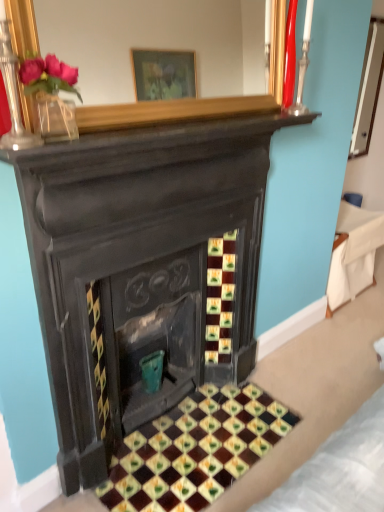
In order to face glazed ceramic tiles at center, should I rotate leftwards or rightwards?

You should rotate right by 1.078 degrees.

I want to click on glazed ceramic tiles at center, so click(194, 450).

From the image's perspective, which object appears higher, white fabric at right or teal ceramic vase at center?

white fabric at right, from the image's perspective.

Considering the relative sizes of white fabric at right and teal ceramic vase at center in the image provided, is white fabric at right thinner than teal ceramic vase at center?

In fact, white fabric at right might be wider than teal ceramic vase at center.

Based on the photo, from a real-world perspective, who is located higher, white fabric at right or teal ceramic vase at center?

white fabric at right.

The height and width of the screenshot is (512, 384). In order to click on teal that appears behind the glazed ceramic tiles at center in this screenshot , I will do `click(152, 371)`.

From a real-world perspective, is glazed ceramic tiles at center beneath teal ceramic vase at center?

Yes, from a real-world perspective, glazed ceramic tiles at center is below teal ceramic vase at center.

Considering the relative positions of glazed ceramic tiles at center and teal ceramic vase at center in the image provided, is glazed ceramic tiles at center to the right of teal ceramic vase at center from the viewer's perspective?

Yes, glazed ceramic tiles at center is to the right of teal ceramic vase at center.

How different are the orientations of teal ceramic vase at center and glazed ceramic tiles at center in degrees?

The angular difference between teal ceramic vase at center and glazed ceramic tiles at center is 0.00473 degrees.

Is teal ceramic vase at center positioned in front of glazed ceramic tiles at center?

No, teal ceramic vase at center is further to the viewer.

From a real-world perspective, relative to glazed ceramic tiles at center, is teal ceramic vase at center vertically above or below?

In terms of real-world spatial position, teal ceramic vase at center is above glazed ceramic tiles at center.

Is teal ceramic vase at center bigger or smaller than glazed ceramic tiles at center?

In the image, teal ceramic vase at center appears to be smaller than glazed ceramic tiles at center.

Is glazed ceramic tiles at center surrounded by white fabric at right?

Definitely not — glazed ceramic tiles at center is not inside white fabric at right.

Is white fabric at right not near glazed ceramic tiles at center?

Yes, white fabric at right is far from glazed ceramic tiles at center.

Where is `furniture above the glazed ceramic tiles at center (from a real-world perspective)`? furniture above the glazed ceramic tiles at center (from a real-world perspective) is located at coordinates (353, 253).

Is glazed ceramic tiles at center situated inside white fabric at right or outside?

glazed ceramic tiles at center is outside white fabric at right.

Looking at this image, does glazed ceramic tiles at center come behind white fabric at right?

No, glazed ceramic tiles at center is closer to the camera.

Which of these two, glazed ceramic tiles at center or white fabric at right, stands shorter?

With less height is glazed ceramic tiles at center.

Who is smaller, glazed ceramic tiles at center or white fabric at right?

glazed ceramic tiles at center.

How many degrees apart are the facing directions of teal ceramic vase at center and white fabric at right?

0.631 degrees.

Is teal ceramic vase at center bigger than white fabric at right?

No, teal ceramic vase at center is not bigger than white fabric at right.

Is teal ceramic vase at center looking in the opposite direction of white fabric at right?

That's not correct — teal ceramic vase at center is not looking away from white fabric at right.

From a real-world perspective, is teal ceramic vase at center beneath white fabric at right?

Indeed, from a real-world perspective, teal ceramic vase at center is positioned beneath white fabric at right.

The height and width of the screenshot is (512, 384). In order to click on teal located below the white fabric at right (from the image's perspective) in this screenshot , I will do `click(152, 371)`.

Find the location of a particular element. This screenshot has width=384, height=512. teal that is on the left side of glazed ceramic tiles at center is located at coordinates (152, 371).

Based on the photo, looking at the image, which one is located further to glazed ceramic tiles at center, teal ceramic vase at center or white fabric at right?

Based on the image, white fabric at right appears to be further to glazed ceramic tiles at center.

When comparing their distances from white fabric at right, does glazed ceramic tiles at center or teal ceramic vase at center seem further?

Based on the image, teal ceramic vase at center appears to be further to white fabric at right.

Based on their spatial positions, is white fabric at right or teal ceramic vase at center closer to glazed ceramic tiles at center?

The object closer to glazed ceramic tiles at center is teal ceramic vase at center.

Looking at the image, which one is located further to white fabric at right, teal ceramic vase at center or glazed ceramic tiles at center?

teal ceramic vase at center is further to white fabric at right.

Considering their positions, is white fabric at right positioned closer to teal ceramic vase at center than glazed ceramic tiles at center?

glazed ceramic tiles at center lies closer to teal ceramic vase at center than the other object.

When comparing their distances from teal ceramic vase at center, does glazed ceramic tiles at center or white fabric at right seem further?

white fabric at right lies further to teal ceramic vase at center than the other object.

Where is `pattern situated between teal ceramic vase at center and white fabric at right from left to right`? This screenshot has width=384, height=512. pattern situated between teal ceramic vase at center and white fabric at right from left to right is located at coordinates (194, 450).